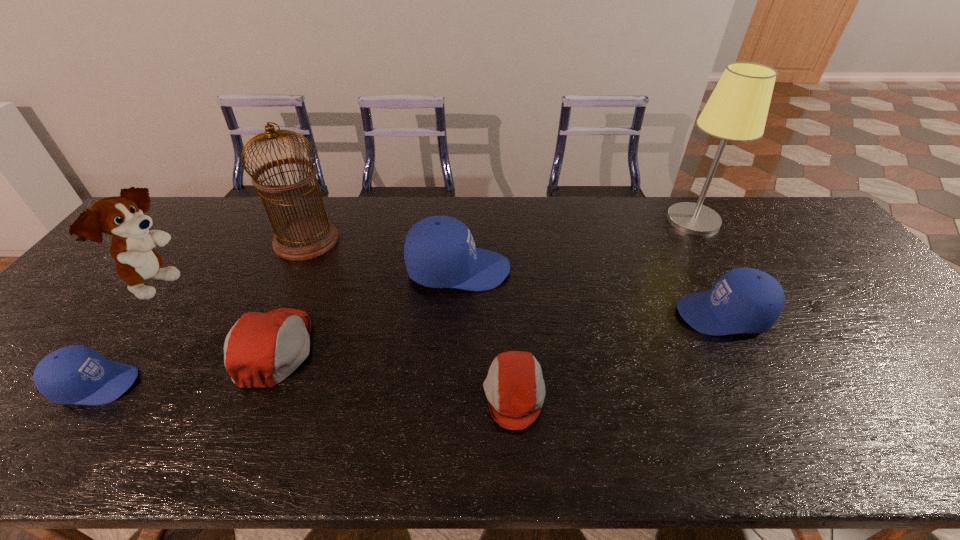
Locate an element on the screen. The width and height of the screenshot is (960, 540). table lamp is located at coordinates (737, 110).

This screenshot has height=540, width=960. I want to click on birdcage, so click(302, 238).

Identify the location of the sixth shortest object. (122, 217).

Image resolution: width=960 pixels, height=540 pixels. In order to click on brown puppy in this screenshot , I will do `click(122, 217)`.

At what (x,y) coordinates should I click in order to perform the action: click on the tallest cap. Please return your answer as a coordinate pair (x, y). Looking at the image, I should click on (439, 251).

You are a GUI agent. You are given a task and a screenshot of the screen. Output one action in this format:
    pyautogui.click(x=<x>, y=<y>)
    Task: Click on the biggest blue cap
    This screenshot has width=960, height=540.
    Given the screenshot: What is the action you would take?
    [x=439, y=251]

Where is `the second smallest blue cap`? Image resolution: width=960 pixels, height=540 pixels. the second smallest blue cap is located at coordinates (744, 300).

Find the location of a particular element. Image resolution: width=960 pixels, height=540 pixels. the rightmost cap is located at coordinates [x=744, y=300].

At what (x,y) coordinates should I click in order to perform the action: click on the left red cap. Please return your answer as a coordinate pair (x, y). The height and width of the screenshot is (540, 960). Looking at the image, I should click on (262, 349).

Identify the location of the bigger red cap. (x=262, y=349).